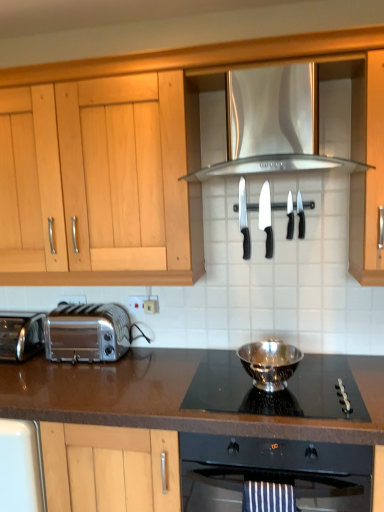
How much space does white plastic electric outlet at center, placed as the 1th electric outlet when sorted from left to right, occupy horizontally?

The width of white plastic electric outlet at center, placed as the 1th electric outlet when sorted from left to right, is 0.52 inches.

Locate an element on the screen. Image resolution: width=384 pixels, height=512 pixels. white plastic electric outlet at center, marked as the 2th electric outlet in a right-to-left arrangement is located at coordinates (72, 298).

You are a GUI agent. You are given a task and a screenshot of the screen. Output one action in this format:
    pyautogui.click(x=<x>, y=<y>)
    Task: Click on the black plastic knife at upper center, the first knife positioned from the right
    
    Given the screenshot: What is the action you would take?
    pyautogui.click(x=300, y=216)

What is the approximate width of white plastic electric outlet at lower center, which appears as the 1th electric outlet when viewed from the front?

The width of white plastic electric outlet at lower center, which appears as the 1th electric outlet when viewed from the front, is 0.80 inches.

What do you see at coordinates (275, 165) in the screenshot?
I see `satin silver exhaust hood at upper center` at bounding box center [275, 165].

I want to click on polished stainless steel bowl at center, so click(270, 362).

At what (x,y) coordinates should I click in order to perform the action: click on white plastic electric outlet at center, placed as the 1th electric outlet when sorted from left to right. Please return your answer as a coordinate pair (x, y). The width and height of the screenshot is (384, 512). Looking at the image, I should click on (72, 298).

Is white plastic electric outlet at center, marked as the 2th electric outlet in a right-to-left arrangement, at the back of brown laminate countertop at center?

No, brown laminate countertop at center's orientation is not away from white plastic electric outlet at center, marked as the 2th electric outlet in a right-to-left arrangement.

In the scene shown: Considering the positions of objects brown laminate countertop at center and white plastic electric outlet at center, the first electric outlet in the back-to-front sequence, in the image provided, who is behind, brown laminate countertop at center or white plastic electric outlet at center, the first electric outlet in the back-to-front sequence,?

Positioned behind is white plastic electric outlet at center, the first electric outlet in the back-to-front sequence.

Which is farther, [7,368] or [62,300]?

The point [62,300] is more distant.

Is polished stainless steel bowl at center next to white plastic electric outlet at center, positioned as the 2th electric outlet in front-to-back order?

No, polished stainless steel bowl at center is not in contact with white plastic electric outlet at center, positioned as the 2th electric outlet in front-to-back order.

Is polished stainless steel bowl at center positioned behind white plastic electric outlet at center, placed as the 1th electric outlet when sorted from left to right?

No, polished stainless steel bowl at center is in front of white plastic electric outlet at center, placed as the 1th electric outlet when sorted from left to right.

You are a GUI agent. You are given a task and a screenshot of the screen. Output one action in this format:
    pyautogui.click(x=<x>, y=<y>)
    Task: Click on the kitchen appliance that is below the white plastic electric outlet at center, placed as the 1th electric outlet when sorted from left to right (from the image's perspective)
    The height and width of the screenshot is (512, 384).
    Given the screenshot: What is the action you would take?
    pyautogui.click(x=270, y=362)

Looking at this image, from the image's perspective, which one is positioned lower, polished stainless steel bowl at center or white plastic electric outlet at center, marked as the 2th electric outlet in a right-to-left arrangement?

polished stainless steel bowl at center, from the image's perspective.

From the image's perspective, which one is positioned higher, black plastic knife at center, the second knife viewed from the left, or black plastic knife at upper center, the first knife positioned from the right?

black plastic knife at upper center, the first knife positioned from the right, appears higher in the image.

Is point (269, 208) closer to viewer compared to point (300, 213)?

No, (269, 208) is further to viewer.

In the scene shown: Does black plastic knife at center, the second knife viewed from the left, touch black plastic knife at upper center, the first knife positioned from the right?

No, black plastic knife at center, the second knife viewed from the left, is not beside black plastic knife at upper center, the first knife positioned from the right.

Which of these two, black plastic knife at center, the second knife viewed from the left, or black plastic knife at upper center, the first knife positioned from the right, is bigger?

black plastic knife at center, the second knife viewed from the left.

Can you see black plastic knife at center, acting as the 2th knife starting from the right, touching polished stainless steel bowl at center?

They are not placed beside each other.

At what (x,y) coordinates should I click in order to perform the action: click on kitchen appliance in front of the black plastic knife at center, acting as the 2th knife starting from the right. Please return your answer as a coordinate pair (x, y). Looking at the image, I should click on (270, 362).

In the scene shown: Is black plastic knife at center, acting as the 2th knife starting from the right, aimed at polished stainless steel bowl at center?

No, black plastic knife at center, acting as the 2th knife starting from the right, does not turn towards polished stainless steel bowl at center.

Locate an element on the screen. This screenshot has height=512, width=384. electric outlet below the white plastic electric outlet at lower center, the 2th electric outlet viewed from the back (from the image's perspective) is located at coordinates (72, 298).

Is white plastic electric outlet at lower center, which appears as the 1th electric outlet when viewed from the front, wider or thinner than white plastic electric outlet at center, marked as the 2th electric outlet in a right-to-left arrangement?

In the image, white plastic electric outlet at lower center, which appears as the 1th electric outlet when viewed from the front, appears to be wider than white plastic electric outlet at center, marked as the 2th electric outlet in a right-to-left arrangement.

From a real-world perspective, is white plastic electric outlet at lower center, positioned as the first electric outlet in right-to-left order, on top of white plastic electric outlet at center, placed as the 1th electric outlet when sorted from left to right?

No, from a real-world perspective, white plastic electric outlet at lower center, positioned as the first electric outlet in right-to-left order, is not above white plastic electric outlet at center, placed as the 1th electric outlet when sorted from left to right.

Considering the relative positions of white plastic electric outlet at lower center, which appears as the 1th electric outlet when viewed from the front, and white plastic electric outlet at center, placed as the 1th electric outlet when sorted from left to right, in the image provided, is white plastic electric outlet at lower center, which appears as the 1th electric outlet when viewed from the front, to the left of white plastic electric outlet at center, placed as the 1th electric outlet when sorted from left to right, from the viewer's perspective?

Incorrect, white plastic electric outlet at lower center, which appears as the 1th electric outlet when viewed from the front, is not on the left side of white plastic electric outlet at center, placed as the 1th electric outlet when sorted from left to right.

Which is closer to the camera, (232,170) or (303,211)?

Point (232,170) appears to be closer to the viewer than point (303,211).

Relative to black plastic knife at upper center, the first knife positioned from the right, is satin silver exhaust hood at upper center in front or behind?

satin silver exhaust hood at upper center is in front of black plastic knife at upper center, the first knife positioned from the right.

From the image's perspective, starting from the satin silver exhaust hood at upper center, which knife is the 1st one below? Please provide its 2D coordinates.

[(300, 216)]

Could black plastic knife at upper center, the first knife positioned from the right, be considered to be inside satin silver exhaust hood at upper center?

No, black plastic knife at upper center, the first knife positioned from the right, is located outside of satin silver exhaust hood at upper center.

Is black plastic knife at center, positioned as the first knife in left-to-right order, next to silver metallic toaster at lower left, which is counted as the 2th toaster, starting from the right, and touching it?

black plastic knife at center, positioned as the first knife in left-to-right order, and silver metallic toaster at lower left, which is counted as the 2th toaster, starting from the right, are clearly separated.

Is black plastic knife at center, positioned as the first knife in left-to-right order, outside of silver metallic toaster at lower left, which is counted as the 2th toaster, starting from the right?

Yes, black plastic knife at center, positioned as the first knife in left-to-right order, is not within silver metallic toaster at lower left, which is counted as the 2th toaster, starting from the right.

Is the depth of black plastic knife at center, positioned as the first knife in left-to-right order, greater than that of silver metallic toaster at lower left, which is counted as the 2th toaster, starting from the right?

No, black plastic knife at center, positioned as the first knife in left-to-right order, is closer to the viewer.

Is black plastic knife at center, the fourth knife in the right-to-left sequence, wider or thinner than silver metallic toaster at lower left, which appears as the first toaster when viewed from the left?

In the image, black plastic knife at center, the fourth knife in the right-to-left sequence, appears to be more narrow than silver metallic toaster at lower left, which appears as the first toaster when viewed from the left.

What are the coordinates of `countertop in front of the white plastic electric outlet at center, placed as the 1th electric outlet when sorted from left to right` in the screenshot? It's located at (169, 398).

From a real-world perspective, count 2nd electric outlets upward from the polished stainless steel bowl at center and point to it. Please provide its 2D coordinates.

[(72, 298)]

Which object lies nearer to the anchor point black plastic knife at upper center, positioned as the fourth knife in left-to-right order, white plastic electric outlet at center, placed as the 1th electric outlet when sorted from left to right, or satin silver exhaust hood at upper center?

Among the two, satin silver exhaust hood at upper center is located nearer to black plastic knife at upper center, positioned as the fourth knife in left-to-right order.

Which object lies further to the anchor point silver metallic bowl at center, white plastic electric outlet at center, positioned as the 2th electric outlet in front-to-back order, or black plastic knife at center, positioned as the first knife in left-to-right order?

white plastic electric outlet at center, positioned as the 2th electric outlet in front-to-back order, is positioned further to the anchor silver metallic bowl at center.

Which object lies further to the anchor point shiny metallic toaster at left, arranged as the first toaster when viewed from the right, satin silver exhaust hood at upper center or polished stainless steel bowl at center?

Among the two, satin silver exhaust hood at upper center is located further to shiny metallic toaster at left, arranged as the first toaster when viewed from the right.

Based on their spatial positions, is satin silver exhaust hood at upper center or white plastic electric outlet at center, marked as the 2th electric outlet in a right-to-left arrangement, further from polished stainless steel bowl at center?

white plastic electric outlet at center, marked as the 2th electric outlet in a right-to-left arrangement, is positioned further to the anchor polished stainless steel bowl at center.

Based on their spatial positions, is white plastic electric outlet at lower center, arranged as the second electric outlet when viewed from the left, or shiny metallic toaster at left, arranged as the first toaster when viewed from the right, further from brown laminate countertop at center?

Among the two, white plastic electric outlet at lower center, arranged as the second electric outlet when viewed from the left, is located further to brown laminate countertop at center.

Looking at the image, which one is located further to silver metallic bowl at center, shiny metallic toaster at left, marked as the second toaster in a left-to-right arrangement, or white plastic electric outlet at lower center, which appears as the 1th electric outlet when viewed from the front?

white plastic electric outlet at lower center, which appears as the 1th electric outlet when viewed from the front, is positioned further to the anchor silver metallic bowl at center.

Considering their positions, is satin silver exhaust hood at upper center positioned closer to black plastic knife at upper center, the first knife positioned from the right, than shiny metallic toaster at left, arranged as the first toaster when viewed from the right?

Based on the image, satin silver exhaust hood at upper center appears to be nearer to black plastic knife at upper center, the first knife positioned from the right.

Which object lies nearer to the anchor point white plastic electric outlet at center, positioned as the 2th electric outlet in front-to-back order, black plastic knife at center, the second knife viewed from the left, or brown laminate countertop at center?

Among the two, brown laminate countertop at center is located nearer to white plastic electric outlet at center, positioned as the 2th electric outlet in front-to-back order.

Locate an element on the screen. This screenshot has height=512, width=384. kitchen appliance between satin silver exhaust hood at upper center and silver metallic bowl at center in the up-down direction is located at coordinates (270, 362).

You are a GUI agent. You are given a task and a screenshot of the screen. Output one action in this format:
    pyautogui.click(x=<x>, y=<y>)
    Task: Click on the kitchen appliance between shiny metallic toaster at left, marked as the second toaster in a left-to-right arrangement, and silver metallic bowl at center, in the horizontal direction
    This screenshot has height=512, width=384.
    Given the screenshot: What is the action you would take?
    pyautogui.click(x=270, y=362)

This screenshot has width=384, height=512. In order to click on electric outlet located between white plastic electric outlet at center, positioned as the 2th electric outlet in front-to-back order, and black plastic knife at upper center, the first knife positioned from the right, in the left-right direction in this screenshot , I will do `click(136, 303)`.

Locate an element on the screen. exhaust hood situated between silver metallic toaster at lower left, which appears as the first toaster when viewed from the left, and black plastic knife at center, the 3th knife from the right, from left to right is located at coordinates (275, 165).